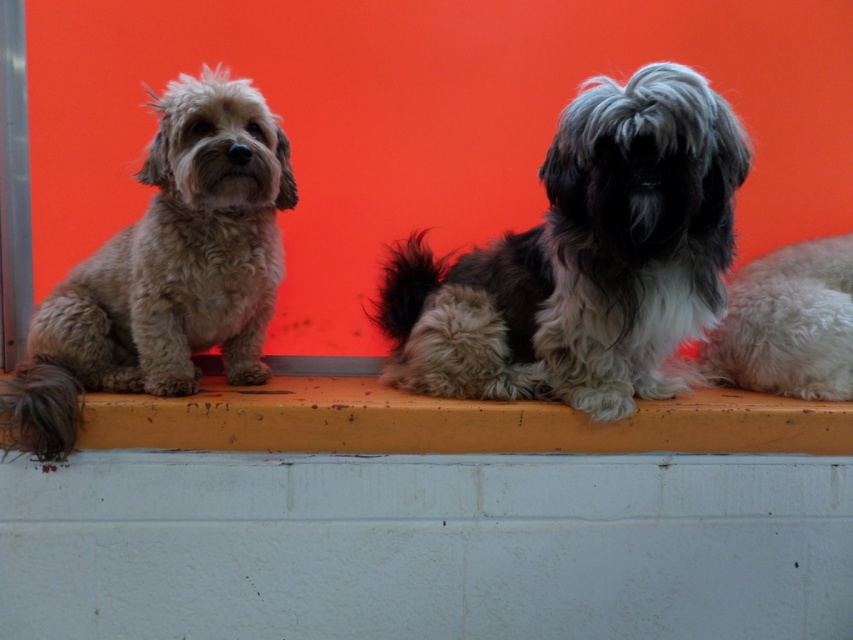
Is fluffy white dog at center positioned at the back of white fluffy dog at center?

No, it is in front of white fluffy dog at center.

Who is shorter, fluffy white dog at center or white fluffy dog at center?

With less height is white fluffy dog at center.

What do you see at coordinates (584, 259) in the screenshot?
I see `fluffy white dog at center` at bounding box center [584, 259].

Find the location of `fluffy white dog at center`. fluffy white dog at center is located at coordinates [x=584, y=259].

Is the position of yellow painted wood at center more distant than that of white fluffy dog at center?

That is False.

Which is in front, point (508, 433) or point (780, 392)?

Point (508, 433) is more forward.

Does point (213, 396) come in front of point (734, 278)?

Yes, it is in front of point (734, 278).

Where is `yellow painted wood at center`? This screenshot has height=640, width=853. yellow painted wood at center is located at coordinates (451, 420).

Is point (32, 413) farther from viewer compared to point (741, 326)?

No, (32, 413) is in front of (741, 326).

Can you confirm if light brown fur at left is wider than white fluffy dog at center?

Yes, light brown fur at left is wider than white fluffy dog at center.

Who is more distant from viewer, (285, 157) or (735, 378)?

Positioned behind is point (735, 378).

Locate an element on the screen. light brown fur at left is located at coordinates (166, 269).